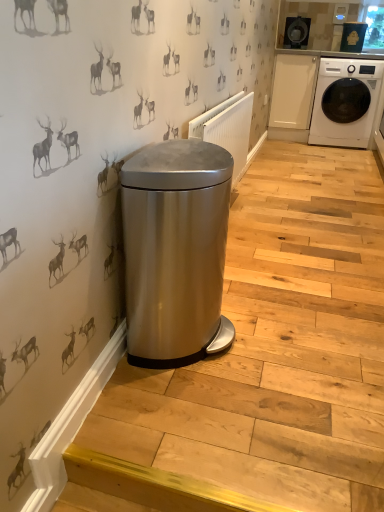
Where is `unoccupied area in front of satin silver trash can at center`? The width and height of the screenshot is (384, 512). unoccupied area in front of satin silver trash can at center is located at coordinates (190, 420).